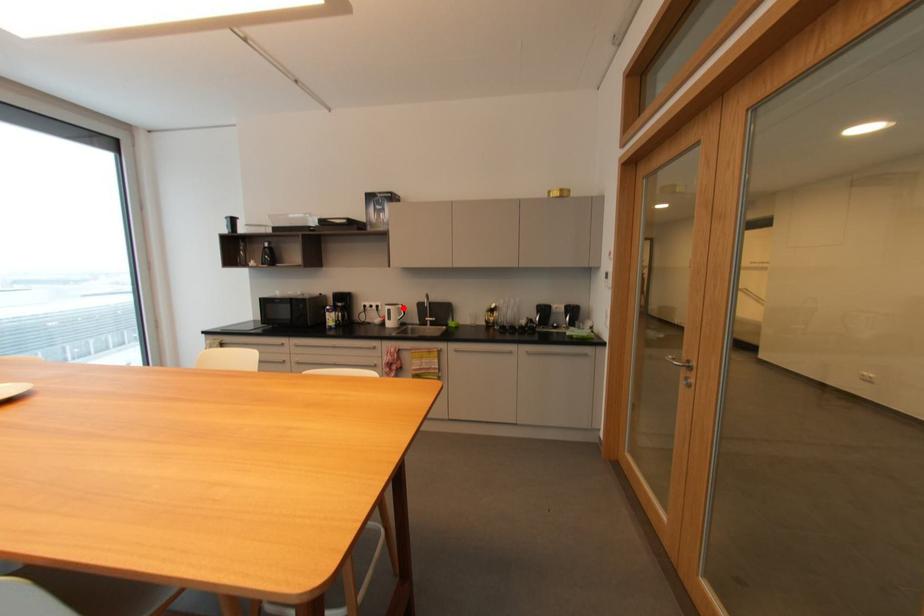
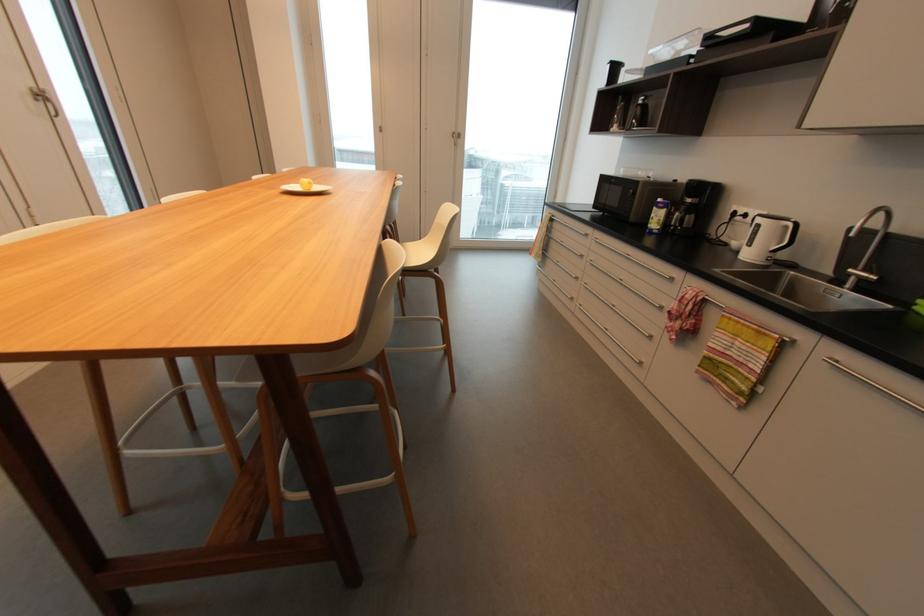
In the second image, find the point that corresponds to the highlighted location in the first image.

(789, 227)